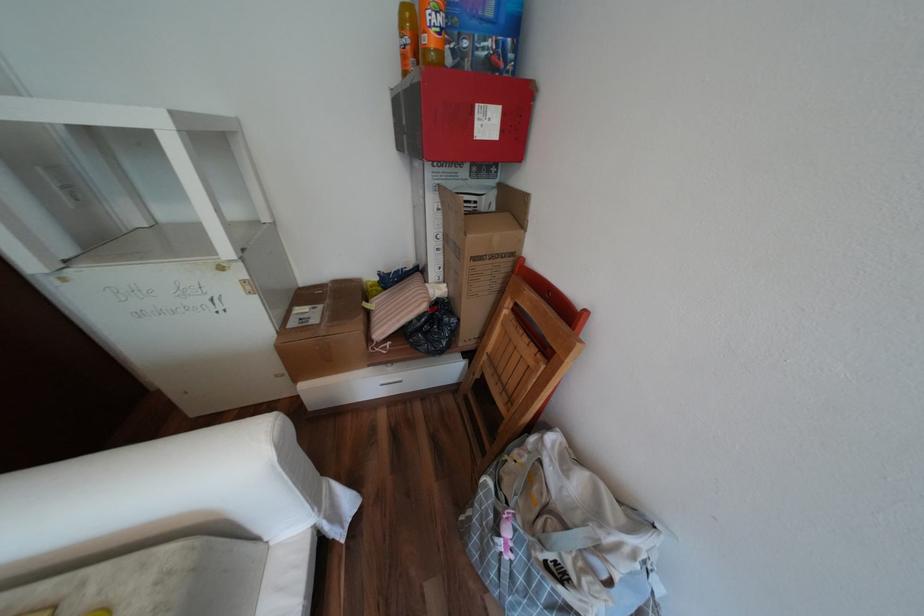
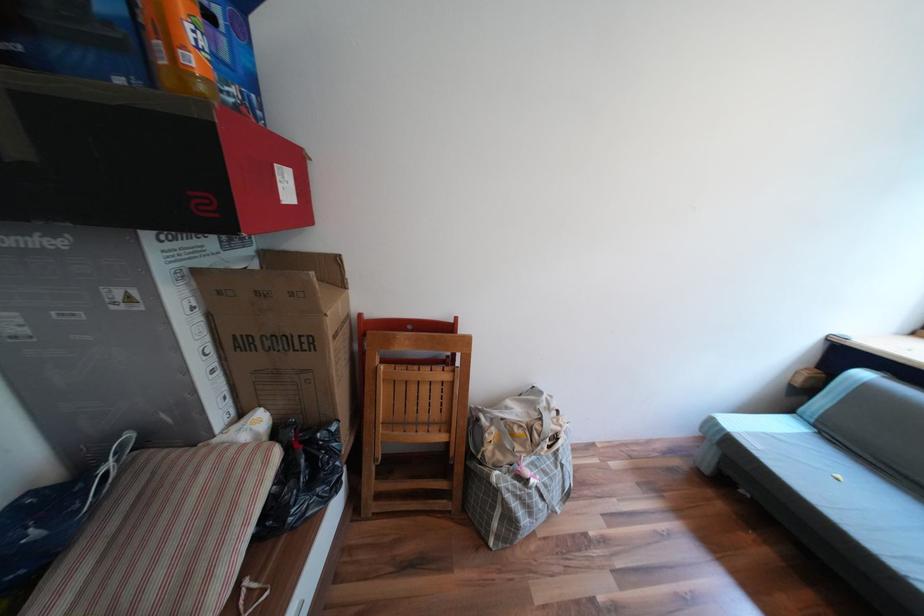
Locate, in the second image, the point that corresponds to (x=487, y=123) in the first image.

(289, 185)